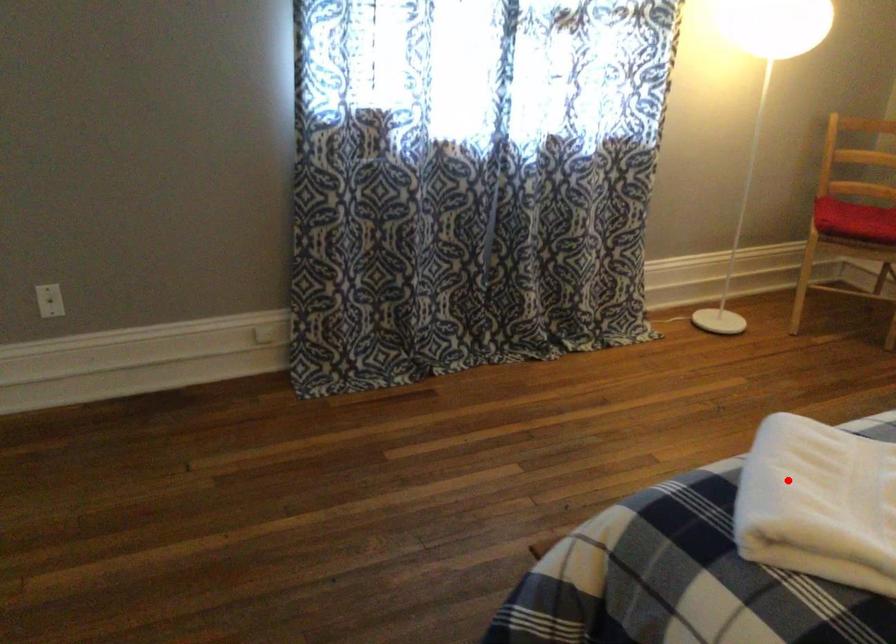
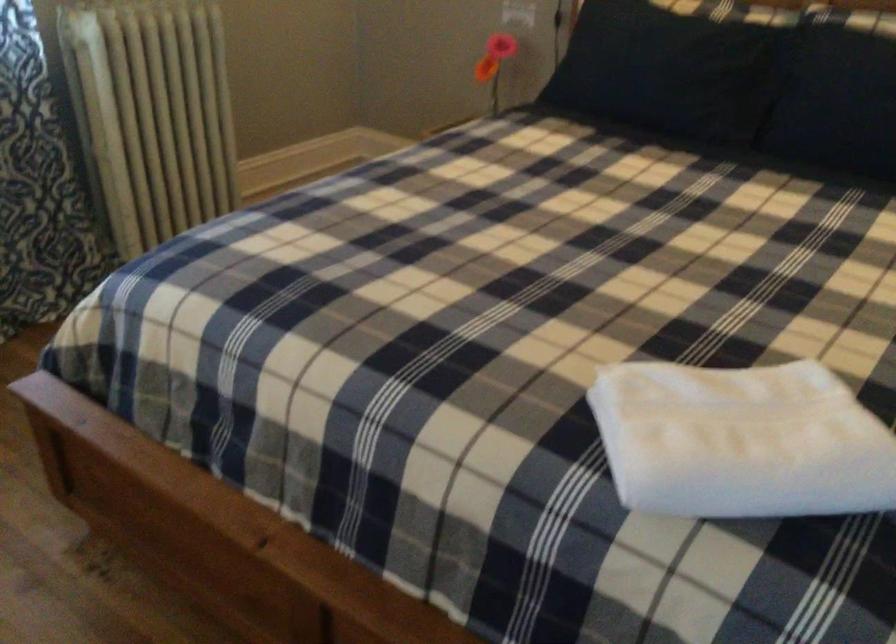
The point at the highlighted location is marked in the first image. Where is the corresponding point in the second image?

(741, 440)